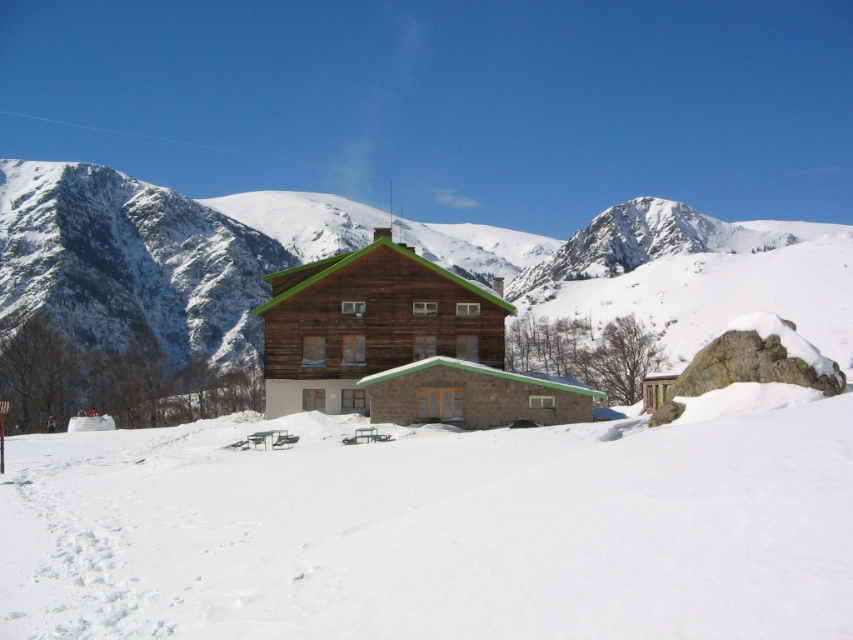
Question: Is snowy rock at center bigger than wooden cabin at center?

Choices:
 (A) yes
 (B) no

Answer: (A)

Question: Which point is closer to the camera?

Choices:
 (A) wooden cabin at center
 (B) white snow at center

Answer: (B)

Question: Is snowy rock at center bigger than wooden cabin at center?

Choices:
 (A) yes
 (B) no

Answer: (A)

Question: Which point is farther from the camera taking this photo?

Choices:
 (A) (479, 588)
 (B) (321, 298)
 (C) (741, 227)

Answer: (C)

Question: Which object is the closest to the wooden cabin at center?

Choices:
 (A) snowy rock at center
 (B) white snow at center

Answer: (B)

Question: Can you confirm if white snow at center is bigger than wooden cabin at center?

Choices:
 (A) no
 (B) yes

Answer: (B)